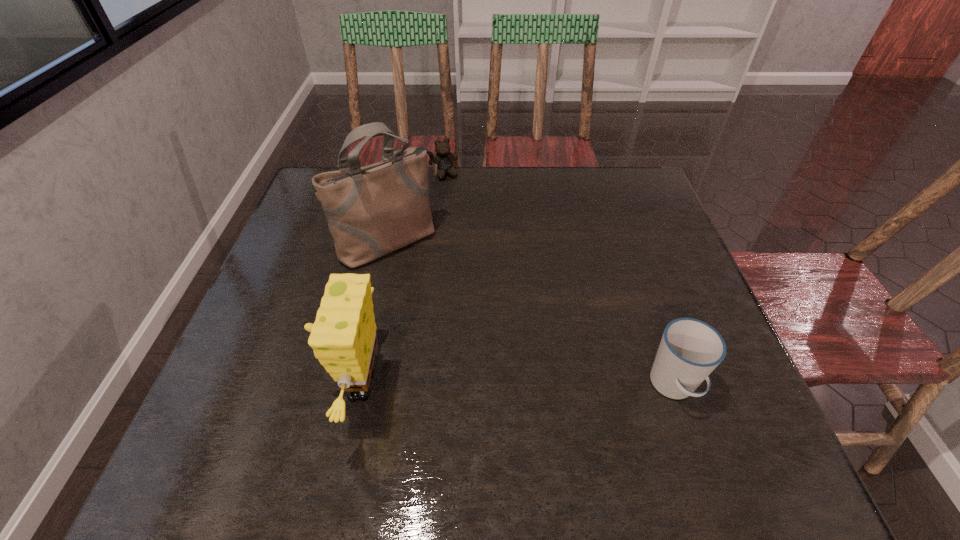
Identify the location of the second tallest object. This screenshot has height=540, width=960. (343, 337).

You are a GUI agent. You are given a task and a screenshot of the screen. Output one action in this format:
    pyautogui.click(x=<x>, y=<y>)
    Task: Click on the third tallest object
    This screenshot has width=960, height=540.
    Given the screenshot: What is the action you would take?
    pos(690,349)

Identify the location of the rightmost object. (690, 349).

Identify the location of the shortest object. The width and height of the screenshot is (960, 540). (444, 158).

The width and height of the screenshot is (960, 540). In order to click on the farthest object in this screenshot , I will do `click(444, 158)`.

You are a GUI agent. You are given a task and a screenshot of the screen. Output one action in this format:
    pyautogui.click(x=<x>, y=<y>)
    Task: Click on the third nearest object
    The height and width of the screenshot is (540, 960).
    Given the screenshot: What is the action you would take?
    pyautogui.click(x=373, y=210)

You are a GUI agent. You are given a task and a screenshot of the screen. Output one action in this format:
    pyautogui.click(x=<x>, y=<y>)
    Task: Click on the tallest object
    
    Given the screenshot: What is the action you would take?
    pyautogui.click(x=373, y=210)

At what (x,y) coordinates should I click in order to perform the action: click on vacant space situated 0.130m on the front-facing side of the second tallest object. Please return your answer as a coordinate pair (x, y). The width and height of the screenshot is (960, 540). Looking at the image, I should click on (263, 385).

You are a GUI agent. You are given a task and a screenshot of the screen. Output one action in this format:
    pyautogui.click(x=<x>, y=<y>)
    Task: Click on the vacant space located on the front-facing side of the second tallest object
    Image resolution: width=960 pixels, height=540 pixels.
    Given the screenshot: What is the action you would take?
    pyautogui.click(x=223, y=385)

The image size is (960, 540). What are the coordinates of `vacant space located 0.200m on the front-facing side of the second tallest object` in the screenshot? It's located at (228, 385).